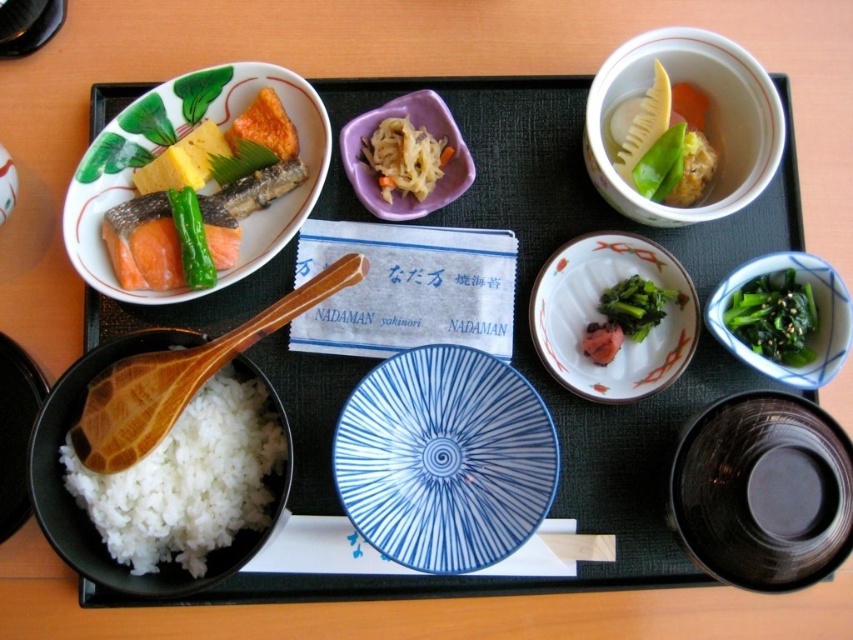
Question: Does porcelain plate with fish and vegetables at upper left appear on the right side of wooden spoon at lower left?

Choices:
 (A) no
 (B) yes

Answer: (A)

Question: Which point is farther to the camera?

Choices:
 (A) (173, 388)
 (B) (283, 99)
 (C) (682, 145)

Answer: (B)

Question: Estimate the real-world distances between objects in this image. Which object is closer to the matte white bowl at center?

Choices:
 (A) black glossy bowl at lower right
 (B) green leafy vegetable at center
 (C) green matte vegetable at upper center
 (D) white matte rice at lower left

Answer: (B)

Question: Is the position of blue and white ceramic bowl at center less distant than that of porcelain bowl with floral design at upper right?

Choices:
 (A) no
 (B) yes

Answer: (B)

Question: Which of these objects is positioned farthest from the purple matte bowl at center?

Choices:
 (A) black glossy bowl at lower right
 (B) white shredded food at center
 (C) white matte rice bowl at lower left
 (D) porcelain bowl with floral design at upper right

Answer: (C)

Question: Is green leafy vegetable at center smaller than green matte vegetable at upper center?

Choices:
 (A) yes
 (B) no

Answer: (B)